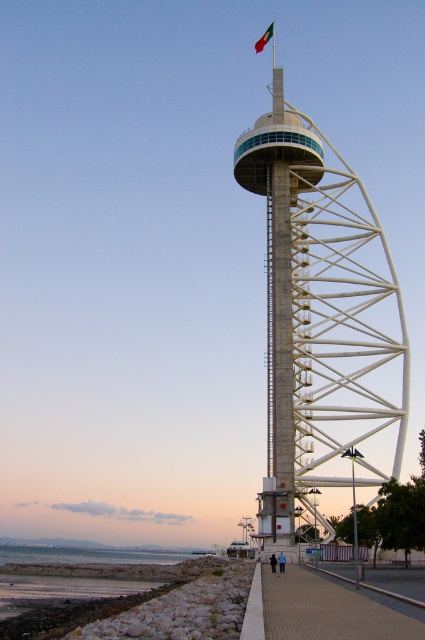
Question: Estimate the real-world distances between objects in this image. Which object is farther from the green fabric flag at upper center?

Choices:
 (A) white concrete tower at center
 (B) paved brick sidewalk at lower center

Answer: (B)

Question: Does paved brick sidewalk at lower center appear over green fabric flag at upper center?

Choices:
 (A) no
 (B) yes

Answer: (A)

Question: Observing the image, what is the correct spatial positioning of paved brick sidewalk at lower center in reference to green fabric flag at upper center?

Choices:
 (A) right
 (B) left

Answer: (A)

Question: Which point is closer to the camera?

Choices:
 (A) paved brick sidewalk at lower center
 (B) green fabric flag at upper center

Answer: (A)

Question: From the image, what is the correct spatial relationship of white concrete tower at center in relation to paved brick sidewalk at lower center?

Choices:
 (A) right
 (B) left

Answer: (A)

Question: Which object is the farthest from the white concrete tower at center?

Choices:
 (A) green fabric flag at upper center
 (B) paved brick sidewalk at lower center

Answer: (A)